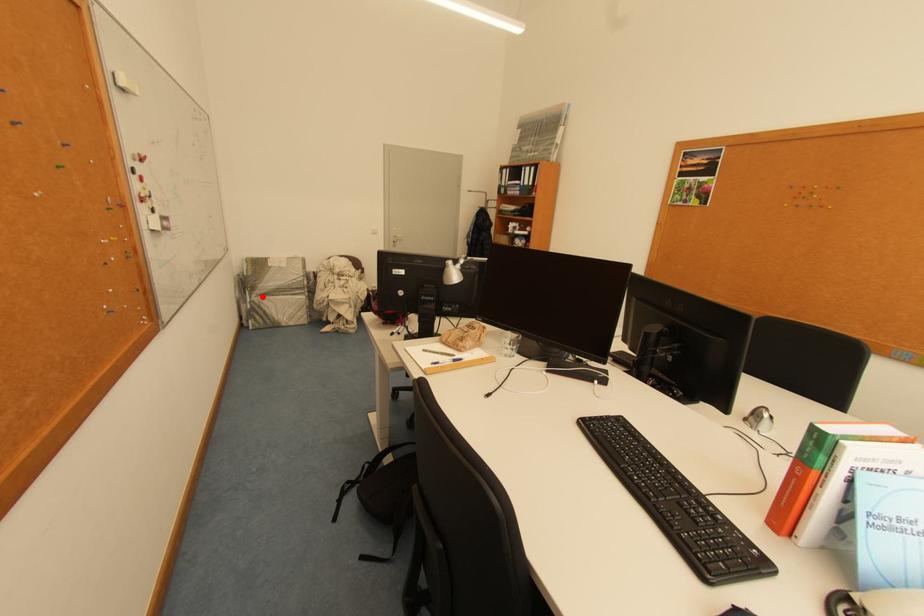
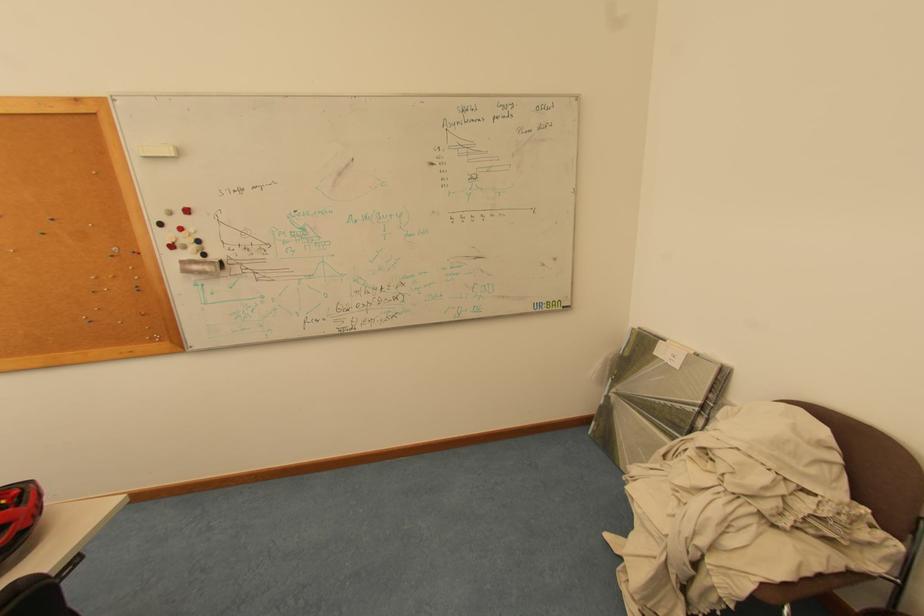
Question: I am providing you with two images of the same scene from different viewpoints. A red point is shown in image1. For the corresponding object point in image2, is it positioned nearer or farther from the camera?

Choices:
 (A) Nearer
 (B) Farther

Answer: (B)